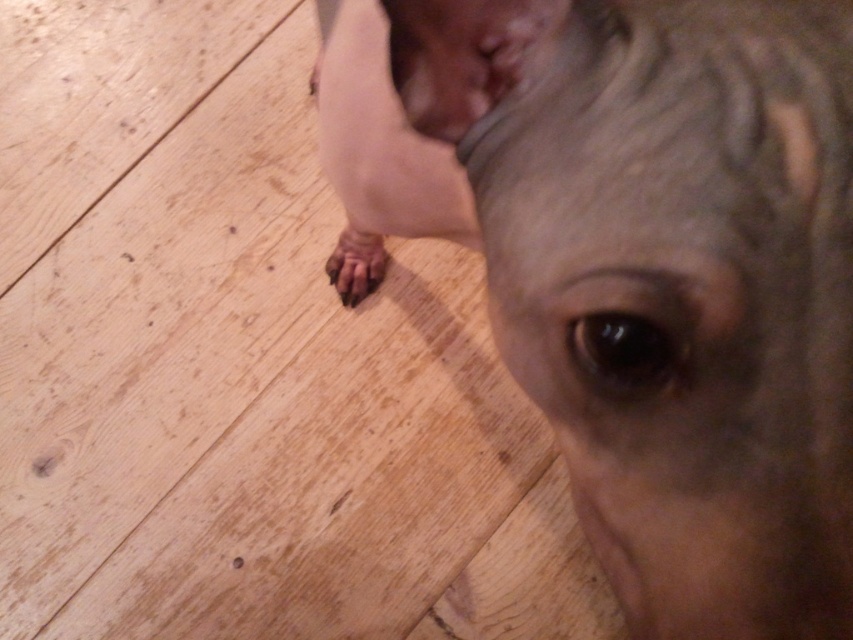
What do you see at coordinates (645, 268) in the screenshot? This screenshot has height=640, width=853. I see `gray matte dog at center` at bounding box center [645, 268].

How far apart are gray matte dog at center and brown rough fur at lower center?

28.68 inches

Is point (496, 60) farther from viewer compared to point (366, 294)?

No, (496, 60) is closer to viewer.

Identify the location of gray matte dog at center. (645, 268).